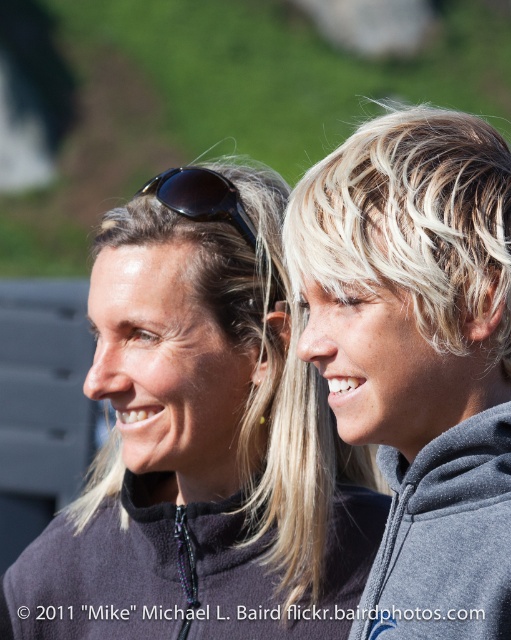
Does dark gray fleece at center have a greater height compared to blondehair at right?

Yes.

Does dark gray fleece at center have a lesser width compared to blondehair at right?

Incorrect, dark gray fleece at center's width is not less than blondehair at right's.

Describe the element at coordinates (201, 440) in the screenshot. This screenshot has height=640, width=511. I see `dark gray fleece at center` at that location.

Locate an element on the screen. The width and height of the screenshot is (511, 640). dark gray fleece at center is located at coordinates (201, 440).

Which of these two, blondehair at right or dark gray fleece sweatshirt at center, stands shorter?

dark gray fleece sweatshirt at center

Is blondehair at right below dark gray fleece sweatshirt at center?

Incorrect, blondehair at right is not positioned below dark gray fleece sweatshirt at center.

Is point (445, 141) positioned in front of point (359, 598)?

Yes.

Find the location of a particular element. This screenshot has width=511, height=640. blondehair at right is located at coordinates [412, 221].

Who is higher up, dark gray fleece sweatshirt at center or black plastic sunglasses at upper center?

black plastic sunglasses at upper center

Who is positioned more to the right, dark gray fleece sweatshirt at center or black plastic sunglasses at upper center?

black plastic sunglasses at upper center

Locate an element on the screen. dark gray fleece sweatshirt at center is located at coordinates (178, 573).